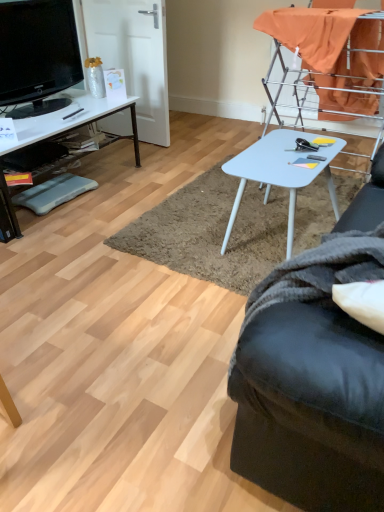
Question: Is blue foam footrest at lower left positioned before white glossy desk at left?

Choices:
 (A) yes
 (B) no

Answer: (B)

Question: From a real-world perspective, is blue foam footrest at lower left below white glossy desk at left?

Choices:
 (A) no
 (B) yes

Answer: (B)

Question: Considering the relative positions of blue foam footrest at lower left and white glossy desk at left in the image provided, is blue foam footrest at lower left to the right of white glossy desk at left from the viewer's perspective?

Choices:
 (A) yes
 (B) no

Answer: (A)

Question: Is blue foam footrest at lower left positioned with its back to white glossy desk at left?

Choices:
 (A) yes
 (B) no

Answer: (A)

Question: Considering the relative positions of blue foam footrest at lower left and white glossy desk at left in the image provided, is blue foam footrest at lower left behind white glossy desk at left?

Choices:
 (A) yes
 (B) no

Answer: (A)

Question: Considering the positions of white glossy desk at left and white plastic table at center in the image, is white glossy desk at left wider or thinner than white plastic table at center?

Choices:
 (A) wide
 (B) thin

Answer: (A)

Question: From their relative heights in the image, would you say white glossy desk at left is taller or shorter than white plastic table at center?

Choices:
 (A) tall
 (B) short

Answer: (B)

Question: From a real-world perspective, relative to white plastic table at center, is white glossy desk at left vertically above or below?

Choices:
 (A) above
 (B) below

Answer: (B)

Question: Relative to white plastic table at center, is white glossy desk at left in front or behind?

Choices:
 (A) front
 (B) behind

Answer: (B)

Question: Visually, is black fabric studio couch at lower right positioned to the left or to the right of light blue plastic table at center?

Choices:
 (A) right
 (B) left

Answer: (B)

Question: Considering their positions, is black fabric studio couch at lower right located in front of or behind light blue plastic table at center?

Choices:
 (A) behind
 (B) front

Answer: (B)

Question: Which is correct: black fabric studio couch at lower right is inside light blue plastic table at center, or outside of it?

Choices:
 (A) inside
 (B) outside

Answer: (B)

Question: In terms of size, does black fabric studio couch at lower right appear bigger or smaller than light blue plastic table at center?

Choices:
 (A) big
 (B) small

Answer: (A)

Question: Relative to black fabric studio couch at lower right, is black plastic pen at left in front or behind?

Choices:
 (A) behind
 (B) front

Answer: (A)

Question: Is black plastic pen at left inside the boundaries of black fabric studio couch at lower right, or outside?

Choices:
 (A) inside
 (B) outside

Answer: (B)